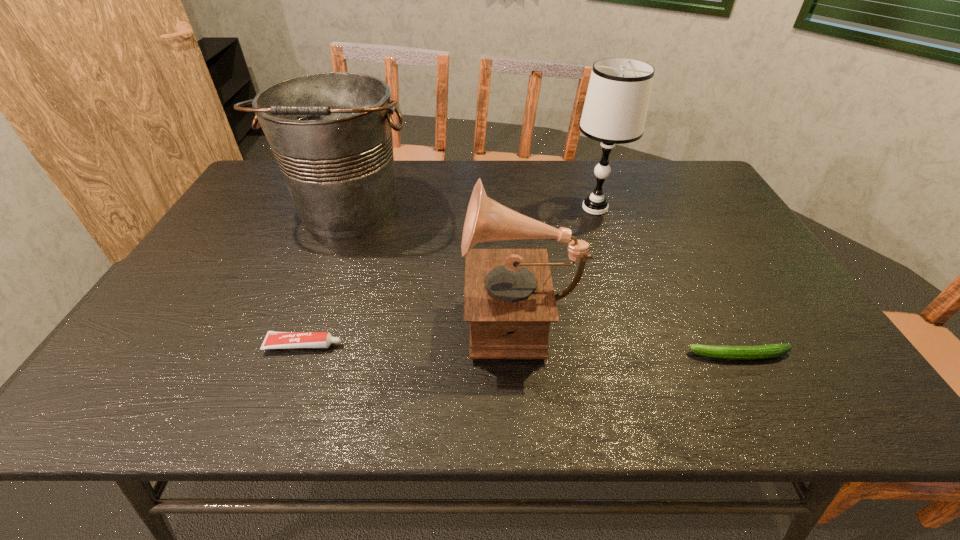
In the image, there is a desktop. Identify the location of vacant space at the right edge. (742, 314).

Image resolution: width=960 pixels, height=540 pixels. Identify the location of free space at the far right corner of the desktop. (676, 187).

The image size is (960, 540). Identify the location of empty space between the second object from right to left and the toothpaste. (449, 276).

The height and width of the screenshot is (540, 960). I want to click on free space between the rightmost object and the record player, so click(630, 334).

Where is `empty space between the toothpaste and the record player`? empty space between the toothpaste and the record player is located at coordinates (412, 329).

Locate an element on the screen. free space between the fourth object from left to right and the record player is located at coordinates (557, 261).

The image size is (960, 540). Find the location of `free space between the third object from left to right and the zucchini`. free space between the third object from left to right and the zucchini is located at coordinates (630, 334).

Identify the location of free space between the table lamp and the record player. Image resolution: width=960 pixels, height=540 pixels. (557, 261).

The width and height of the screenshot is (960, 540). In order to click on the second closest object relative to the bucket in this screenshot , I will do `click(274, 340)`.

Where is `object that is the third closest to the third object from right to left`? object that is the third closest to the third object from right to left is located at coordinates click(771, 350).